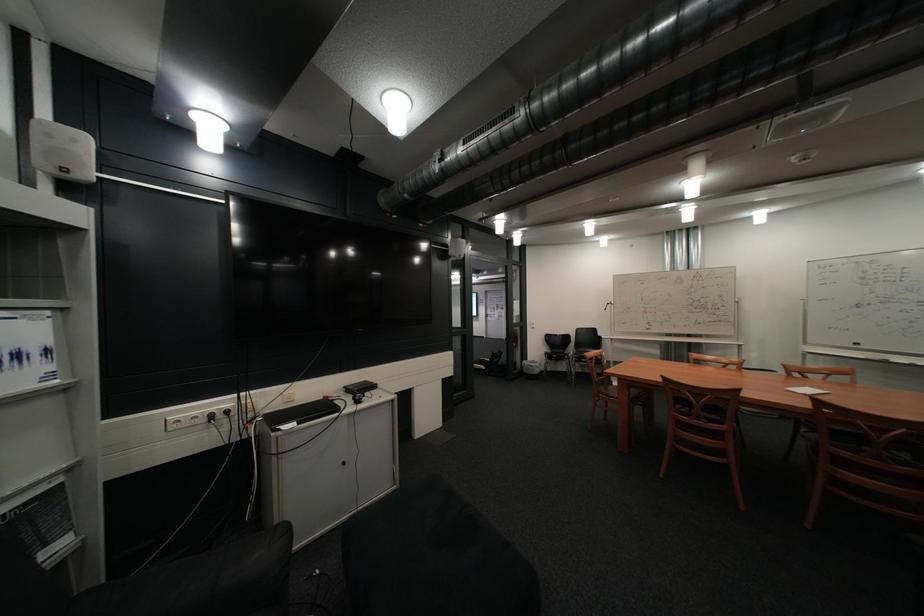
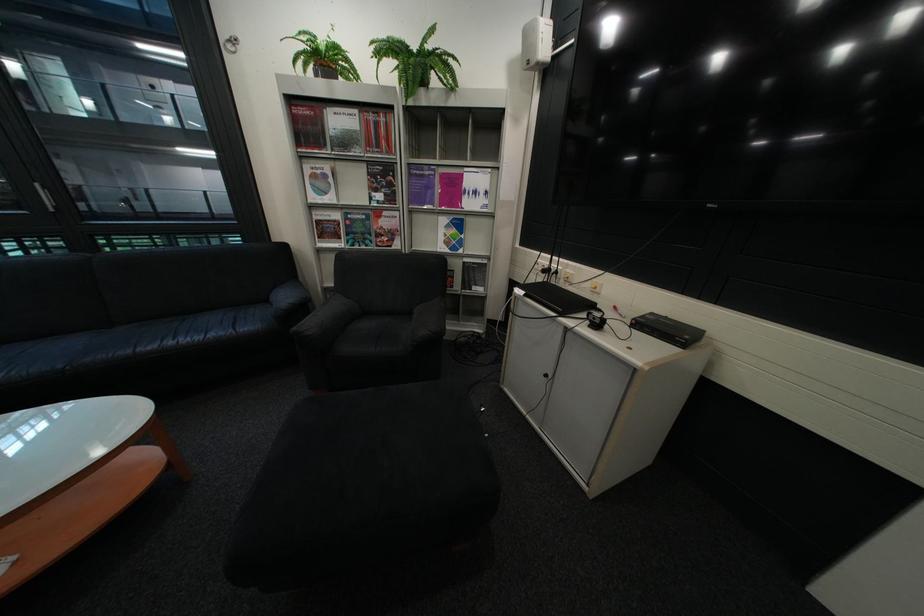
Locate, in the second image, the point that corresponds to (x=226, y=418) in the first image.

(563, 270)